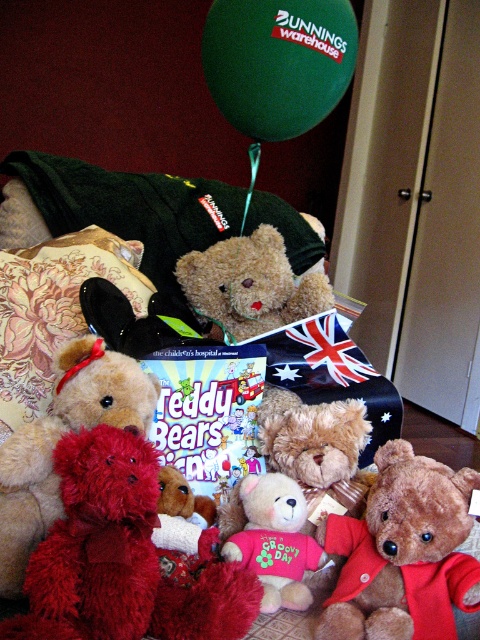
You are standing in front of a display of teddy bears and a green balloon. You want to place a small gift exactly at the point marked as point (303, 474). If your hand is 1 meter away from the display, can you reach the point without moving closer?

The distance of point (303, 474) from viewer is 1.10 meters, so your hand is 1 meter away from the display. Since the point is 0.10 meters further away than your current reach, you cannot reach it without moving closer.

You are a photographer trying to capture a clear shot of the green matte balloon at upper center and the fuzzy brown teddy bear at center. Which object is positioned closer to your camera lens?

The green matte balloon at upper center is closer to the viewer than the fuzzy brown teddy bear at center, so the balloon will be closer to the camera lens.